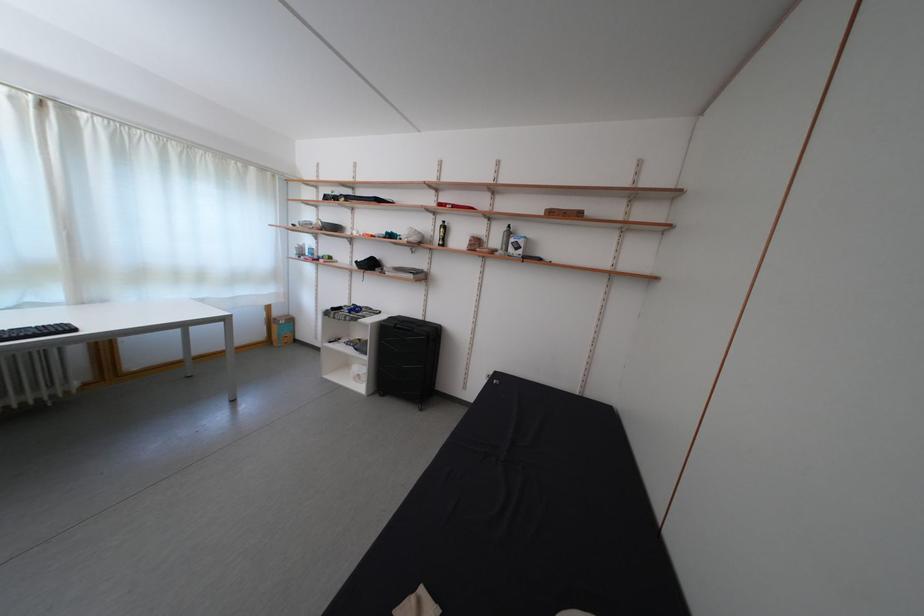
Locate an element on the screen. black suitcase handle is located at coordinates (409, 325).